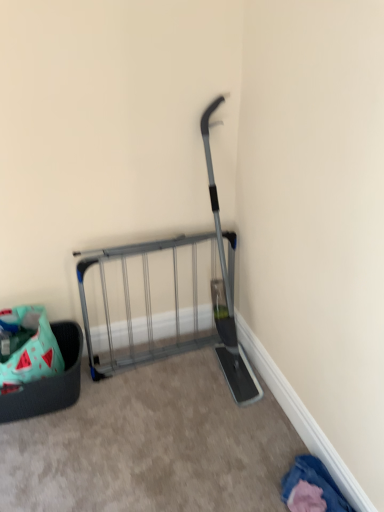
Question: In the image, is silver metallic gate at center positioned in front of or behind denim fabric pants at lower right?

Choices:
 (A) behind
 (B) front

Answer: (A)

Question: From their relative heights in the image, would you say silver metallic gate at center is taller or shorter than denim fabric pants at lower right?

Choices:
 (A) short
 (B) tall

Answer: (B)

Question: Which object is positioned closest to the denim fabric pants at lower right?

Choices:
 (A) silver metallic gate at center
 (B) mint fabric basket at lower left

Answer: (A)

Question: Estimate the real-world distances between objects in this image. Which object is closer to the silver metallic gate at center?

Choices:
 (A) mint fabric basket at lower left
 (B) denim fabric pants at lower right

Answer: (A)